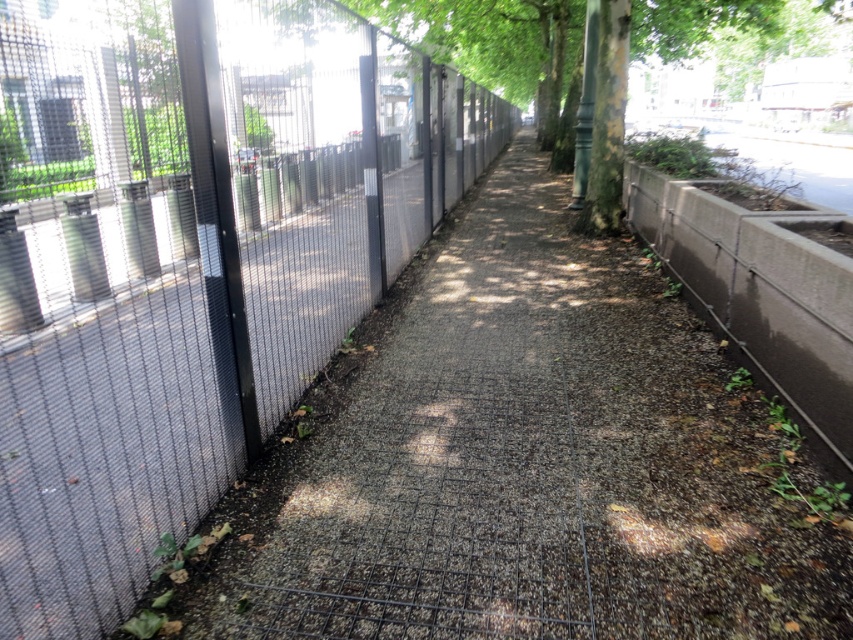
You are a delivery person carrying a large box that is 1.5 meters wide. You need to navigate through the narrow pedestrian pathway. Can you pass through the pathway between the metal mesh fence at left and the green textured tree at center without tilting the box?

The metal mesh fence at left is smaller than the green textured tree at center, but the pathway between them is narrow. Since the box is 1.5 meters wide, it may not fit if the pathway is narrower than 1.5 meters. However, the description does not provide the exact width of the pathway, so it is uncertain whether the box can pass without tilting.

You are standing at the point marked as point (289,131) on the pathway. You want to walk to the end of the pathway, which is 10 meters away. Can you reach the end without walking more than 10 meters?

The distance from point (289,131) to the viewer is 8.85 meters. Since the end of the pathway is 10 meters away from your current position, you can reach it without exceeding the 10 meters limit.

You are a delivery person carrying a heavy box and need to walk along the gray gravel pavement at center. There is a green textured tree at center above you. Is there enough vertical clearance for you to pass under the tree without hitting your head?

The gray gravel pavement at center is below the green textured tree at center, so there is vertical clearance for you to pass under the tree without hitting your head.